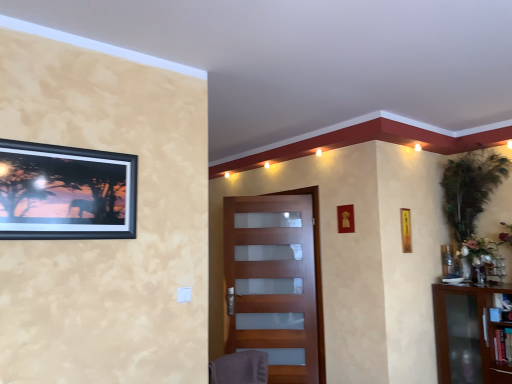
Question: Based on their positions, is matte wood door at center located to the left or right of transparent glass cabinet at right?

Choices:
 (A) left
 (B) right

Answer: (A)

Question: From a real-world perspective, is matte wood door at center positioned above or below transparent glass cabinet at right?

Choices:
 (A) above
 (B) below

Answer: (A)

Question: Which object is the farthest from the gray fabric swivel chair at lower center?

Choices:
 (A) green leafy plant at upper right
 (B) black matte picture frame at upper left, which ranks as the first picture frame in front-to-back order
 (C) matte wood door at center
 (D) transparent glass cabinet at right
 (E) yellow paper at upper right, the second picture frame when ordered from top to bottom

Answer: (A)

Question: Which object is the closest to the transparent glass cabinet at right?

Choices:
 (A) gray fabric swivel chair at lower center
 (B) black matte picture frame at upper left, acting as the 2th picture frame starting from the back
 (C) yellow paper at upper right, placed as the second picture frame when sorted from front to back
 (D) green leafy plant at upper right
 (E) matte wood door at center

Answer: (C)